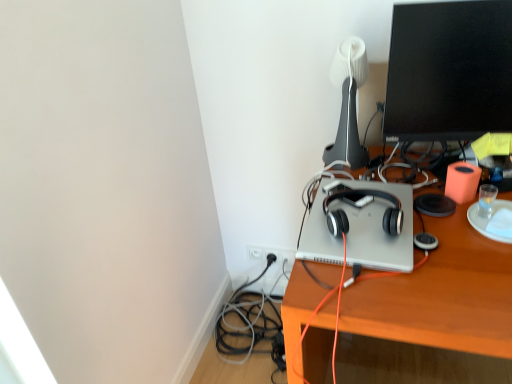
Locate an element on the screen. This screenshot has width=512, height=384. free space in front of silver metallic laptop at center is located at coordinates (401, 291).